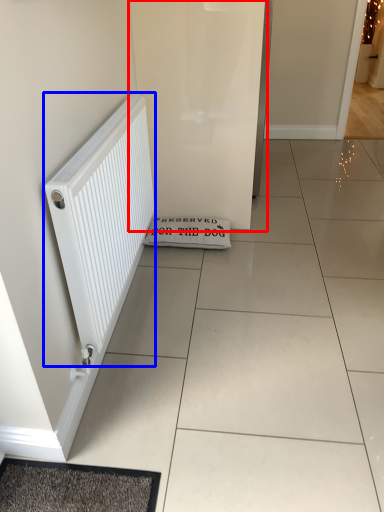
Question: Which object appears closest to the camera in this image, screen door (highlighted by a red box) or radiator (highlighted by a blue box)?

Choices:
 (A) screen door
 (B) radiator

Answer: (B)